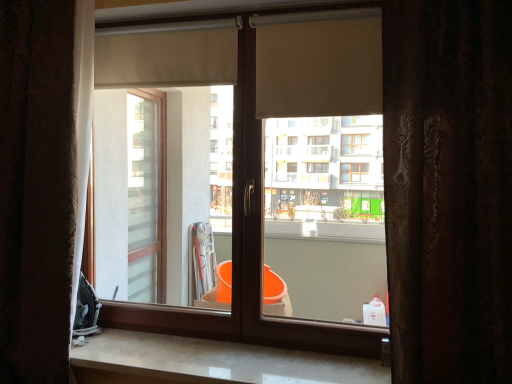
Question: From a real-world perspective, is beige fabric roller at upper center, the second shutter viewed from the back, physically below brown textured curtain at left, acting as the 1th curtain starting from the left?

Choices:
 (A) yes
 (B) no

Answer: (B)

Question: Is brown textured curtain at left, which is counted as the 2th curtain, starting from the right, at the back of beige fabric roller at upper center, which appears as the second shutter when viewed from the left?

Choices:
 (A) yes
 (B) no

Answer: (B)

Question: Is beige fabric roller at upper center, the first shutter viewed from the right, touching brown textured curtain at left, which is counted as the 2th curtain, starting from the right?

Choices:
 (A) no
 (B) yes

Answer: (A)

Question: Is beige fabric roller at upper center, the second shutter viewed from the back, not inside brown textured curtain at left, which appears as the 2th curtain when viewed from the front?

Choices:
 (A) yes
 (B) no

Answer: (A)

Question: Is beige fabric roller at upper center, the first shutter viewed from the right, not close to brown textured curtain at left, marked as the 1th curtain in a back-to-front arrangement?

Choices:
 (A) no
 (B) yes

Answer: (A)

Question: From a real-world perspective, is beige fabric roller at upper center, which appears as the second shutter when viewed from the left, physically located above or below white marble counter top at lower center?

Choices:
 (A) above
 (B) below

Answer: (A)

Question: Is beige fabric roller at upper center, the 1th shutter when ordered from front to back, spatially inside white marble counter top at lower center, or outside of it?

Choices:
 (A) inside
 (B) outside

Answer: (B)

Question: From the image's perspective, is beige fabric roller at upper center, the 1th shutter when ordered from front to back, above or below white marble counter top at lower center?

Choices:
 (A) below
 (B) above

Answer: (B)

Question: Considering the positions of beige fabric roller at upper center, which appears as the second shutter when viewed from the left, and white marble counter top at lower center in the image, is beige fabric roller at upper center, which appears as the second shutter when viewed from the left, taller or shorter than white marble counter top at lower center?

Choices:
 (A) short
 (B) tall

Answer: (B)

Question: In the image, is brown textured curtain at left, which is counted as the 2th curtain, starting from the right, positioned in front of or behind brown textured curtain at right, the second curtain in the back-to-front sequence?

Choices:
 (A) behind
 (B) front

Answer: (A)

Question: Is brown textured curtain at left, acting as the 1th curtain starting from the left, to the left or to the right of brown textured curtain at right, which appears as the first curtain when viewed from the right, in the image?

Choices:
 (A) right
 (B) left

Answer: (B)

Question: Based on their sizes in the image, would you say brown textured curtain at left, marked as the 1th curtain in a back-to-front arrangement, is bigger or smaller than brown textured curtain at right, which is counted as the first curtain, starting from the front?

Choices:
 (A) small
 (B) big

Answer: (A)

Question: Does point 44,192 appear closer or farther from the camera than point 455,91?

Choices:
 (A) closer
 (B) farther

Answer: (B)

Question: Based on their positions, is white marble counter top at lower center located to the left or right of beige fabric roller at upper center, the second shutter viewed from the back?

Choices:
 (A) right
 (B) left

Answer: (B)

Question: From a real-world perspective, relative to beige fabric roller at upper center, the second shutter viewed from the back, is white marble counter top at lower center vertically above or below?

Choices:
 (A) below
 (B) above

Answer: (A)